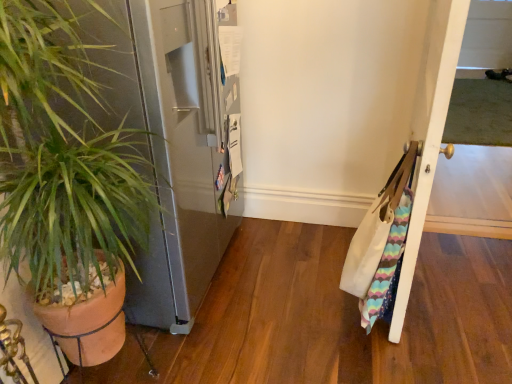
Consider the image. What is the approximate width of white wood door at right?

white wood door at right is 7.14 inches wide.

In order to face white wood door at right, should I rotate leftwards or rightwards?

A 21.293 degree turn to the right will do.

The image size is (512, 384). Describe the element at coordinates (429, 130) in the screenshot. I see `white wood door at right` at that location.

This screenshot has width=512, height=384. Find the location of `white wood door at right`. white wood door at right is located at coordinates (429, 130).

This screenshot has width=512, height=384. Describe the element at coordinates (64, 158) in the screenshot. I see `green leafy plant in terracotta pot at left` at that location.

This screenshot has height=384, width=512. I want to click on green leafy plant in terracotta pot at left, so click(64, 158).

The image size is (512, 384). I want to click on white wood door at right, so click(429, 130).

Considering the positions of objects green leafy plant in terracotta pot at left and white wood door at right in the image provided, who is more to the left, green leafy plant in terracotta pot at left or white wood door at right?

Positioned to the left is green leafy plant in terracotta pot at left.

Consider the image. Is green leafy plant in terracotta pot at left behind white wood door at right?

No, it is not.

Is point (45, 245) closer or farther from the camera than point (437, 149)?

Point (45, 245).

From the image's perspective, would you say green leafy plant in terracotta pot at left is shown under white wood door at right?

Yes, from the image's perspective, green leafy plant in terracotta pot at left is below white wood door at right.

From a real-world perspective, is green leafy plant in terracotta pot at left positioned over white wood door at right based on gravity?

Indeed, from a real-world perspective, green leafy plant in terracotta pot at left stands above white wood door at right.

Is green leafy plant in terracotta pot at left wider or thinner than white wood door at right?

Clearly, green leafy plant in terracotta pot at left has more width compared to white wood door at right.

Considering the relative sizes of green leafy plant in terracotta pot at left and white wood door at right in the image provided, is green leafy plant in terracotta pot at left taller than white wood door at right?

Yes, green leafy plant in terracotta pot at left is taller than white wood door at right.

Is green leafy plant in terracotta pot at left bigger or smaller than white wood door at right?

Clearly, green leafy plant in terracotta pot at left is larger in size than white wood door at right.

Is green leafy plant in terracotta pot at left completely or partially outside of white wood door at right?

That's correct, green leafy plant in terracotta pot at left is outside of white wood door at right.

Is green leafy plant in terracotta pot at left directly adjacent to white wood door at right?

green leafy plant in terracotta pot at left is not next to white wood door at right, and they're not touching.

Could you tell me if green leafy plant in terracotta pot at left is turned towards white wood door at right?

No, green leafy plant in terracotta pot at left does not turn towards white wood door at right.

Looking at this image, how different are the orientations of green leafy plant in terracotta pot at left and white wood door at right in degrees?

The angular difference between green leafy plant in terracotta pot at left and white wood door at right is 4.32 degrees.

This screenshot has width=512, height=384. I want to click on houseplant on the left of white wood door at right, so click(x=64, y=158).

Consider the image. Considering the positions of objects white wood door at right and green leafy plant in terracotta pot at left in the image provided, who is more to the left, white wood door at right or green leafy plant in terracotta pot at left?

green leafy plant in terracotta pot at left is more to the left.

Does white wood door at right lie behind green leafy plant in terracotta pot at left?

Yes, white wood door at right is further from the viewer.

Considering the points (401, 270) and (6, 203), which point is behind, point (401, 270) or point (6, 203)?

The point (401, 270) is behind.

From the image's perspective, who appears lower, white wood door at right or green leafy plant in terracotta pot at left?

green leafy plant in terracotta pot at left, from the image's perspective.

From a real-world perspective, is white wood door at right positioned over green leafy plant in terracotta pot at left based on gravity?

No.

Is white wood door at right wider than green leafy plant in terracotta pot at left?

In fact, white wood door at right might be narrower than green leafy plant in terracotta pot at left.

Does white wood door at right have a lesser height compared to green leafy plant in terracotta pot at left?

Indeed, white wood door at right has a lesser height compared to green leafy plant in terracotta pot at left.

Can you confirm if white wood door at right is smaller than green leafy plant in terracotta pot at left?

Yes, white wood door at right is smaller than green leafy plant in terracotta pot at left.

Could green leafy plant in terracotta pot at left be considered to be inside white wood door at right?

Actually, green leafy plant in terracotta pot at left is outside white wood door at right.

Is white wood door at right placed right next to green leafy plant in terracotta pot at left?

No, white wood door at right is not beside green leafy plant in terracotta pot at left.

Is white wood door at right positioned with its back to green leafy plant in terracotta pot at left?

That's not correct — white wood door at right is not looking away from green leafy plant in terracotta pot at left.

Measure the distance between white wood door at right and green leafy plant in terracotta pot at left.

They are 1.04 meters apart.

At what (x,y) coordinates should I click in order to perform the action: click on door below the green leafy plant in terracotta pot at left (from a real-world perspective). Please return your answer as a coordinate pair (x, y). Looking at the image, I should click on (429, 130).

The image size is (512, 384). Identify the location of houseplant that is above the white wood door at right (from a real-world perspective). (64, 158).

Where is `door behind the green leafy plant in terracotta pot at left`? door behind the green leafy plant in terracotta pot at left is located at coordinates (429, 130).